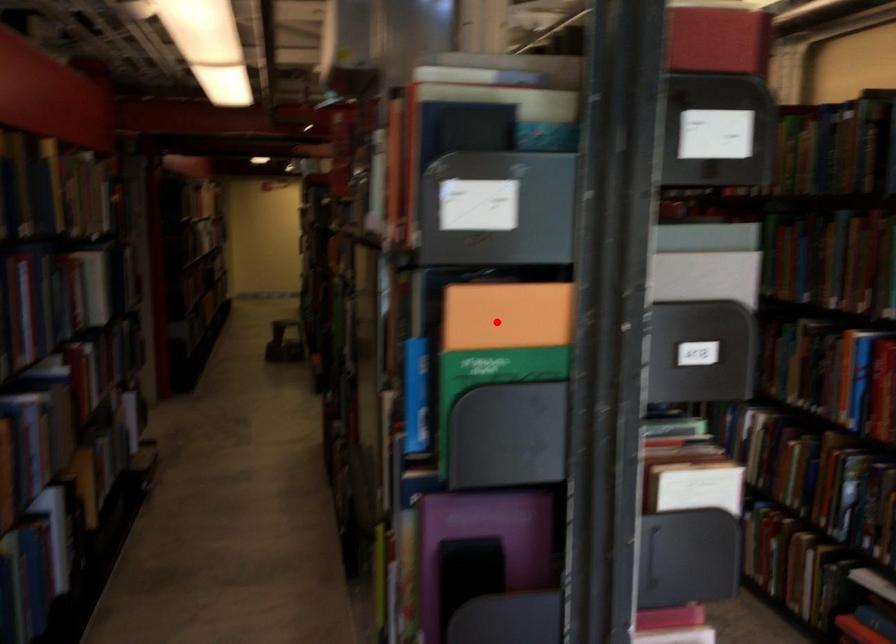
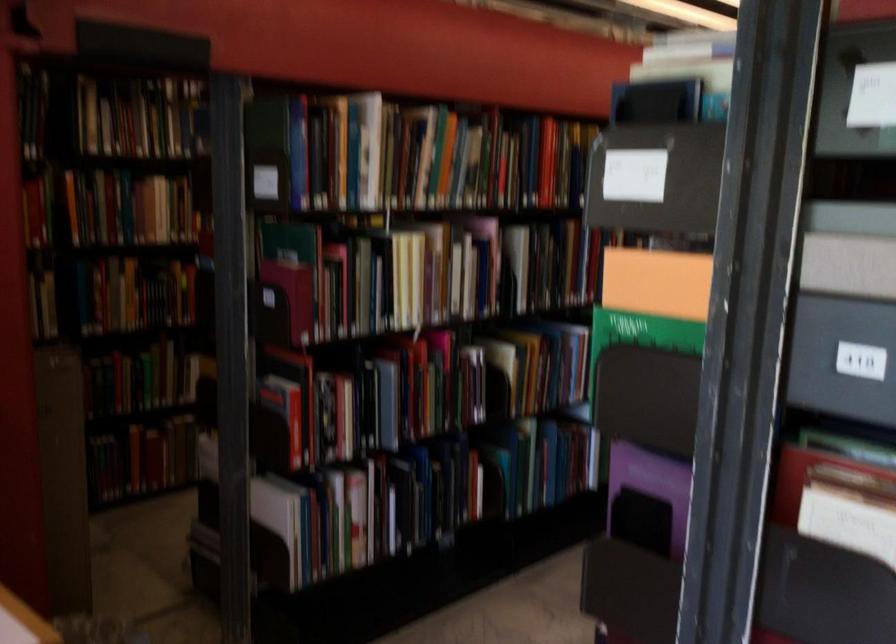
Where in the second image is the point corresponding to the highlighted location from the first image?

(657, 283)